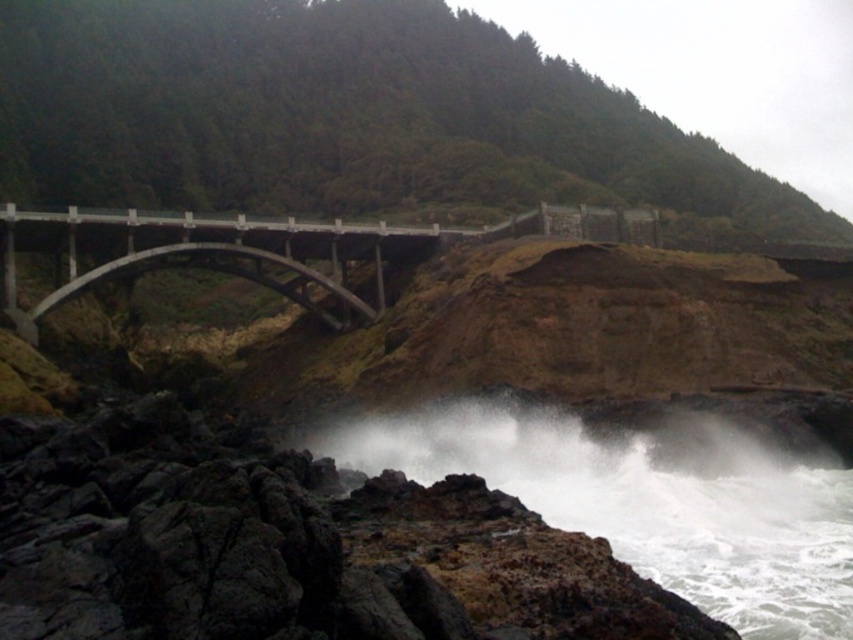
Question: Does white frothy water at lower center appear over concrete bridge at center?

Choices:
 (A) yes
 (B) no

Answer: (B)

Question: Which object is closer to the camera taking this photo?

Choices:
 (A) white frothy water at lower center
 (B) concrete bridge at center

Answer: (A)

Question: Does white frothy water at lower center appear on the right side of concrete bridge at center?

Choices:
 (A) yes
 (B) no

Answer: (A)

Question: Which point is closer to the camera?

Choices:
 (A) concrete bridge at center
 (B) white frothy water at lower center

Answer: (B)

Question: Where is white frothy water at lower center located in relation to concrete bridge at center in the image?

Choices:
 (A) left
 (B) right

Answer: (B)